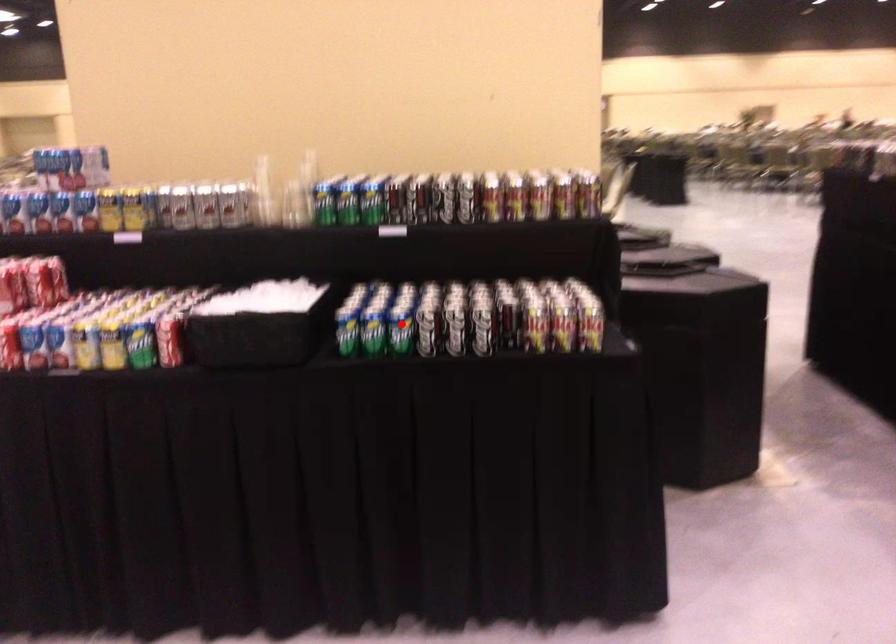
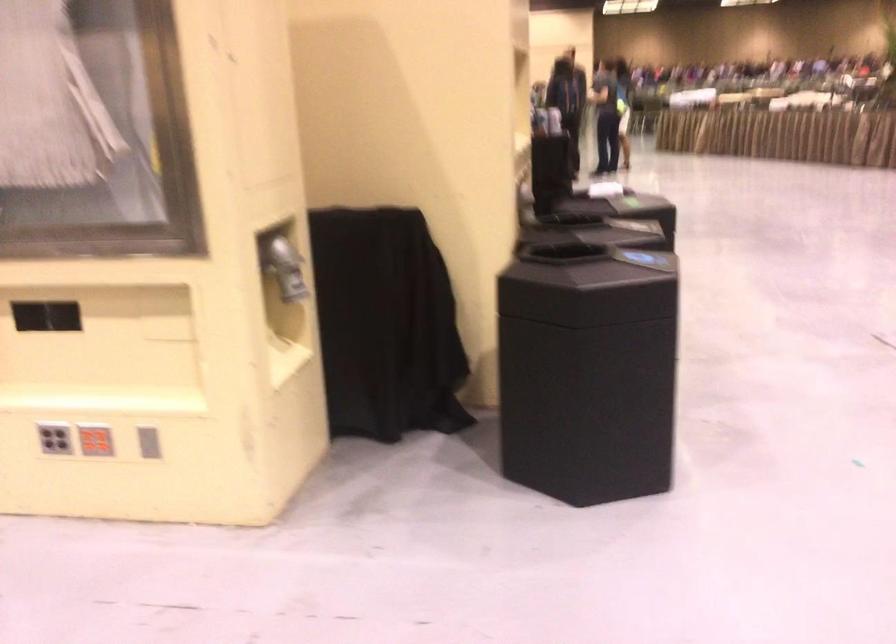
Question: I am providing you with two images of the same scene from different viewpoints. A red point is marked on the first image. Can you still see the location of the red point in image 2?

Choices:
 (A) Yes
 (B) No

Answer: (B)